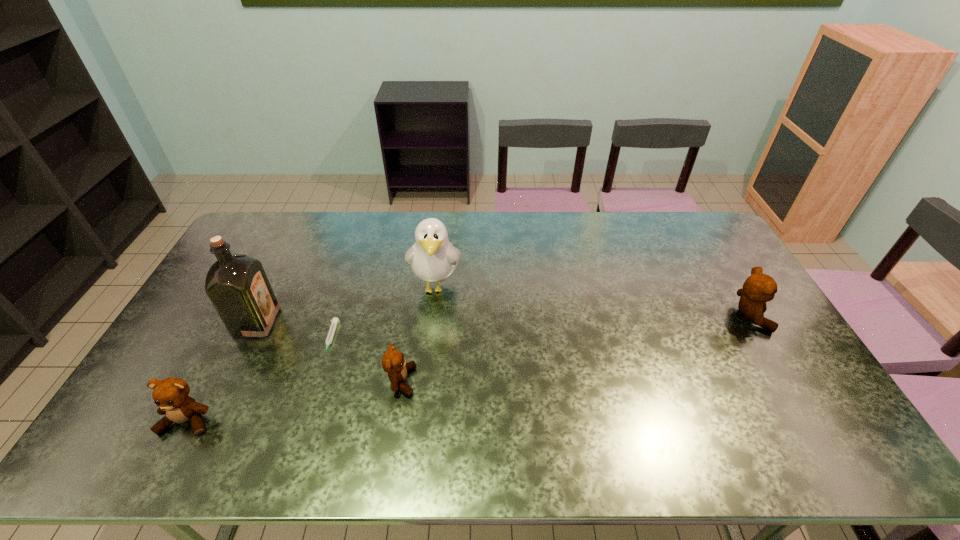
Identify the location of the leftmost teddy bear. The height and width of the screenshot is (540, 960). click(x=171, y=396).

Image resolution: width=960 pixels, height=540 pixels. What are the coordinates of `the second tallest teddy bear` in the screenshot? It's located at (171, 396).

Identify the location of the fifth tallest object. Image resolution: width=960 pixels, height=540 pixels. (393, 362).

Find the location of a particular element. the second nearest object is located at coordinates (393, 362).

Locate an element on the screen. This screenshot has height=540, width=960. the rightmost object is located at coordinates coord(759,288).

Find the location of a particular element. the rightmost teddy bear is located at coordinates [759, 288].

You are a GUI agent. You are given a task and a screenshot of the screen. Output one action in this format:
    pyautogui.click(x=<x>, y=<y>)
    Task: Click on the shortest object
    This screenshot has width=960, height=540.
    Given the screenshot: What is the action you would take?
    pyautogui.click(x=335, y=321)

The width and height of the screenshot is (960, 540). In order to click on syringe in this screenshot , I will do `click(335, 321)`.

I want to click on liquor, so click(237, 285).

At what (x,y) coordinates should I click in order to perform the action: click on gull. Please return your answer as a coordinate pair (x, y). The width and height of the screenshot is (960, 540). Looking at the image, I should click on (433, 258).